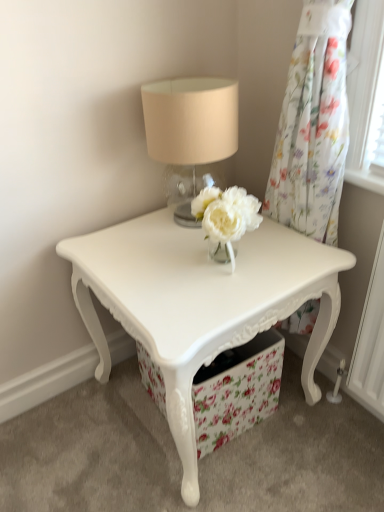
Locate an element on the screen. Image resolution: width=384 pixels, height=512 pixels. vacant space situated on the left part of floral fabric drawer at center is located at coordinates 112,421.